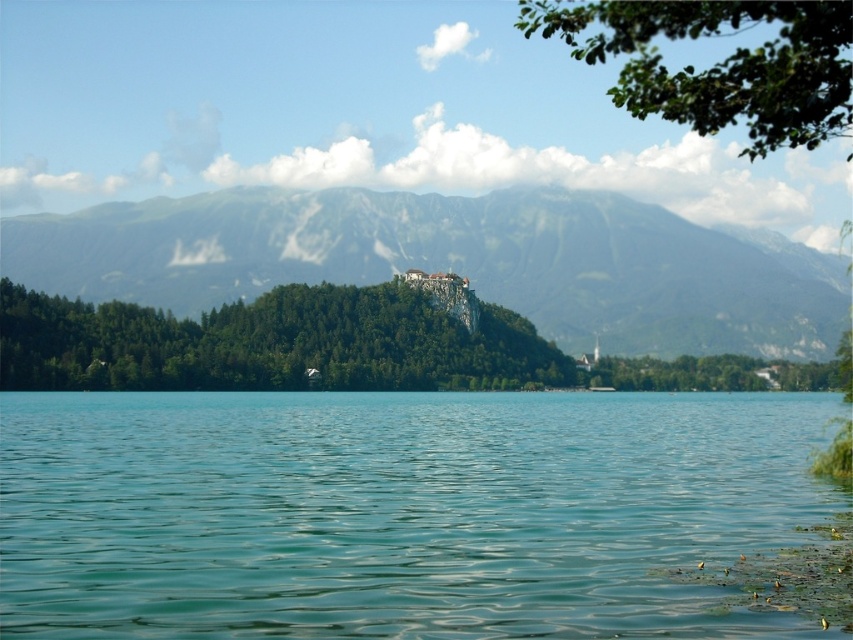
You are an artist trying to paint this scene. You want to ensure the green leafy branch at upper right and the green leafy tree at center are placed correctly in terms of depth. According to the scene, which object should appear closer to you?

The green leafy tree at center should appear closer to you because the green leafy branch at upper right is behind it.

Based on the photo, you are an artist planning to paint this landscape. You want to ensure that the clear water at center and the green leafy tree at center are both visible in your painting. Given their sizes, which object should you focus on placing first to ensure it fits properly?

The clear water at center occupies less space than the green leafy tree at center, so you should focus on placing the green leafy tree at center first to ensure it fits properly before adding the smaller clear water at center.

You are standing at the edge of the lake and see the point marked at coordinates (397,513). What is located at that point?

The point at coordinates (397,513) corresponds to clear water at center.